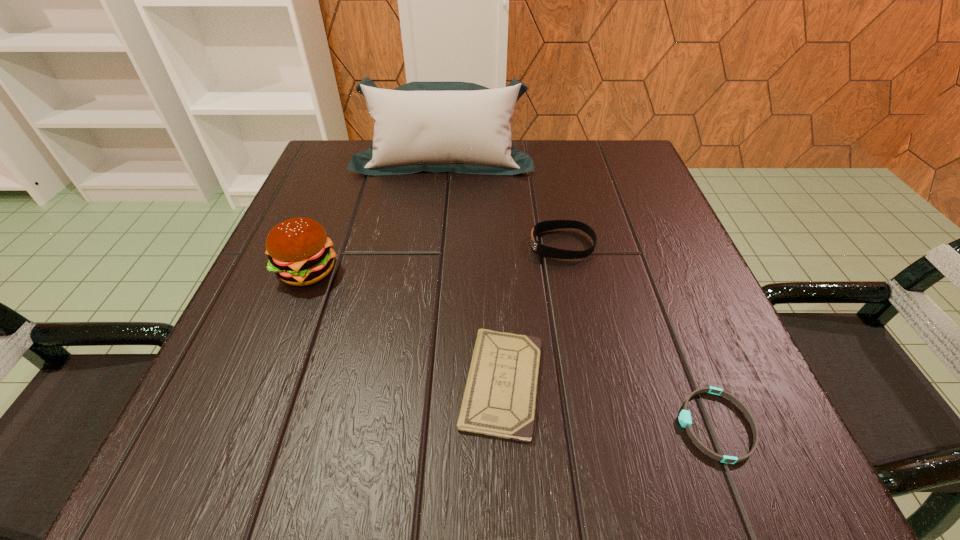
The width and height of the screenshot is (960, 540). Identify the location of free spot located 0.100m on the display of the farther wristband. (476, 245).

At what (x,y) coordinates should I click in order to perform the action: click on vacant space situated on the display of the farther wristband. Please return your answer as a coordinate pair (x, y). The height and width of the screenshot is (540, 960). Looking at the image, I should click on (444, 245).

Locate an element on the screen. The image size is (960, 540). free spot located 0.110m on the display of the farther wristband is located at coordinates (470, 245).

At what (x,y) coordinates should I click in order to perform the action: click on vacant space located on the back of the checkbook. Please return your answer as a coordinate pair (x, y). This screenshot has height=540, width=960. Looking at the image, I should click on (497, 262).

Where is `vacant area situated 0.110m on the buckle of the nearer wristband`? vacant area situated 0.110m on the buckle of the nearer wristband is located at coordinates (593, 425).

Image resolution: width=960 pixels, height=540 pixels. Find the location of `free spot located on the buckle of the nearer wristband`. free spot located on the buckle of the nearer wristband is located at coordinates (491, 425).

The height and width of the screenshot is (540, 960). Find the location of `free spot located on the buckle of the nearer wristband`. free spot located on the buckle of the nearer wristband is located at coordinates (389, 425).

Find the location of a particular element. This screenshot has height=540, width=960. object located in the far edge section of the desktop is located at coordinates (460, 127).

Locate an element on the screen. This screenshot has height=540, width=960. checkbook at the near edge is located at coordinates (499, 400).

Identify the location of wristband that is at the near edge. (685, 420).